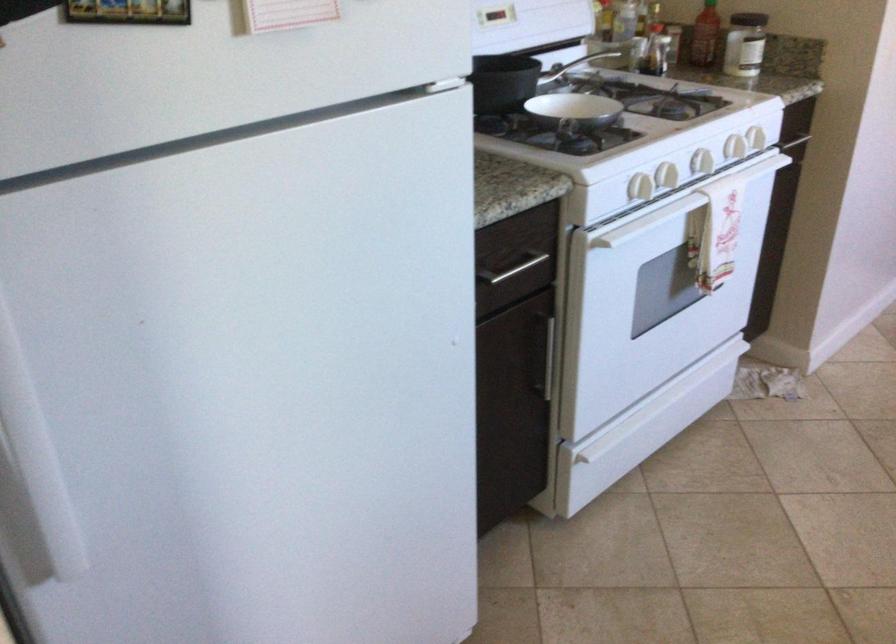
Locate an element on the screen. This screenshot has width=896, height=644. white oven handle is located at coordinates (640, 187).